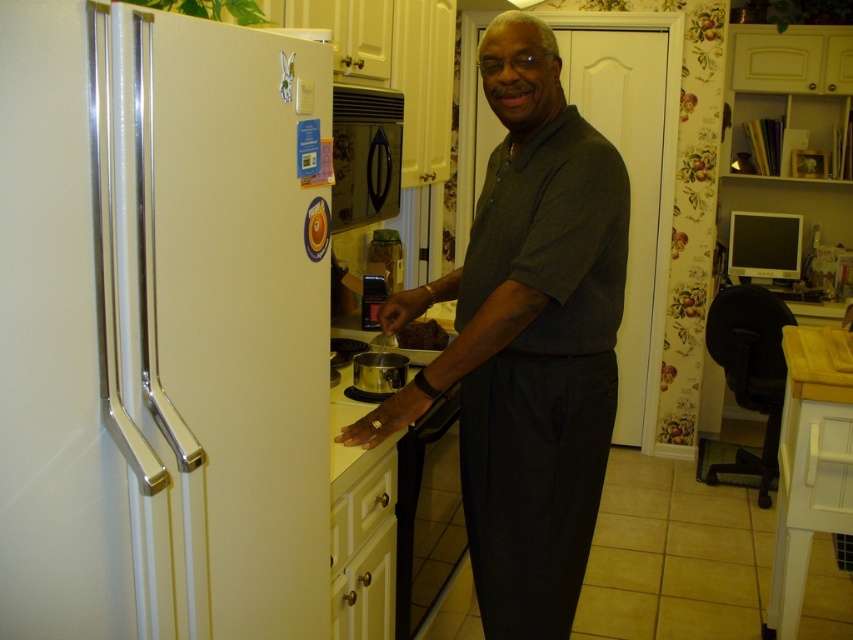
Is white matte refrigerator at left bigger than dark gray shirt at center?

Actually, white matte refrigerator at left might be smaller than dark gray shirt at center.

Between white matte refrigerator at left and dark gray shirt at center, which one has less height?

With less height is white matte refrigerator at left.

Between point (154, 352) and point (473, 260), which one is positioned behind?

Point (473, 260)

The height and width of the screenshot is (640, 853). I want to click on white matte refrigerator at left, so click(x=161, y=326).

Who is shorter, dark gray shirt at center or matte black monitor at right?

Standing shorter between the two is matte black monitor at right.

You are a GUI agent. You are given a task and a screenshot of the screen. Output one action in this format:
    pyautogui.click(x=<x>, y=<y>)
    Task: Click on the dark gray shirt at center
    
    Given the screenshot: What is the action you would take?
    pyautogui.click(x=527, y=340)

Can you confirm if dark gray shirt at center is positioned to the left of satin silver pot at center?

No, dark gray shirt at center is not to the left of satin silver pot at center.

Is dark gray shirt at center smaller than satin silver pot at center?

No, dark gray shirt at center is not smaller than satin silver pot at center.

Locate an element on the screen. Image resolution: width=853 pixels, height=640 pixels. dark gray shirt at center is located at coordinates click(x=527, y=340).

Where is `dark gray shirt at center`? dark gray shirt at center is located at coordinates (527, 340).